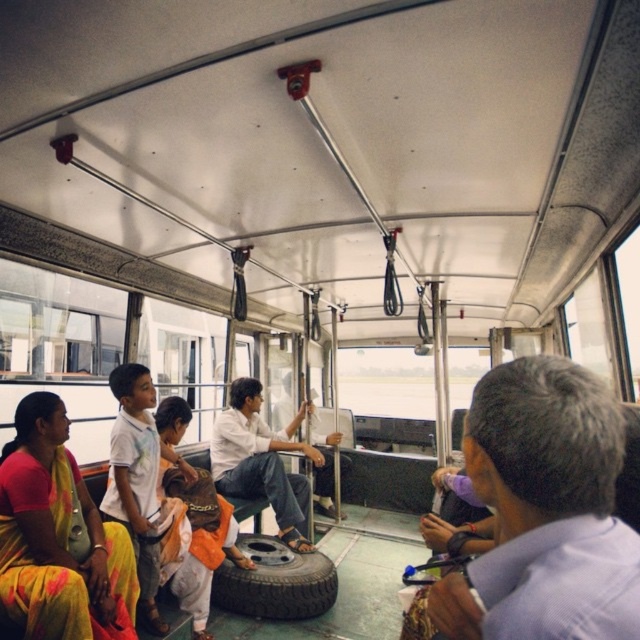
Can you confirm if white matte shirt at center is positioned above dark gray rubber tire at center?

Yes.

Does white matte shirt at center appear under dark gray rubber tire at center?

Actually, white matte shirt at center is above dark gray rubber tire at center.

Which is in front, point (218, 435) or point (252, 545)?

Point (252, 545)

This screenshot has height=640, width=640. What are the coordinates of `white matte shirt at center` in the screenshot? It's located at (260, 461).

Who is taller, yellow cotton saree at lower left or white matte shirt at center?

With more height is white matte shirt at center.

Is yellow cotton saree at lower left taller than white matte shirt at center?

In fact, yellow cotton saree at lower left may be shorter than white matte shirt at center.

The image size is (640, 640). I want to click on yellow cotton saree at lower left, so [x=58, y=538].

Which is below, yellow cotton saree at lower left or dark gray rubber tire at center?

dark gray rubber tire at center is lower down.

Is yellow cotton saree at lower left to the right of dark gray rubber tire at center from the viewer's perspective?

Incorrect, yellow cotton saree at lower left is not on the right side of dark gray rubber tire at center.

This screenshot has width=640, height=640. I want to click on yellow cotton saree at lower left, so click(58, 538).